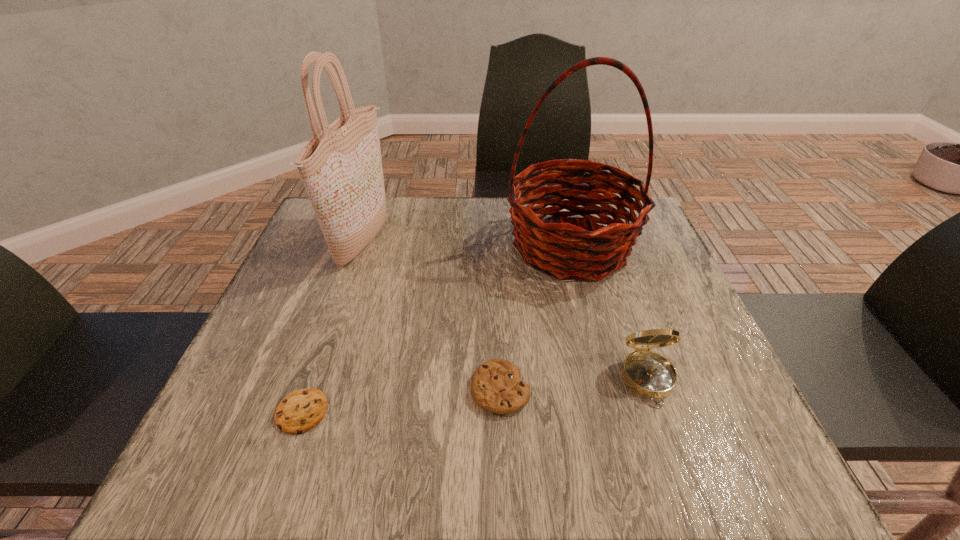
Where is `vacant region located on the back of the taller cookie`? The height and width of the screenshot is (540, 960). vacant region located on the back of the taller cookie is located at coordinates [x=496, y=282].

Identify the location of vacant point located 0.100m on the right of the shorter cookie. (386, 412).

Identify the location of shopping bag that is at the far edge. This screenshot has height=540, width=960. (341, 167).

Find the location of a particular element. This screenshot has width=960, height=540. basket located in the far edge section of the desktop is located at coordinates (565, 250).

At what (x,y) coordinates should I click in order to perform the action: click on object located in the near edge section of the desktop. Please return your answer as a coordinate pair (x, y). Looking at the image, I should click on (300, 411).

At what (x,y) coordinates should I click in order to perform the action: click on shopping bag located in the left edge section of the desktop. Please return your answer as a coordinate pair (x, y). Looking at the image, I should click on (341, 167).

Where is `cookie situated at the left edge`? cookie situated at the left edge is located at coordinates point(300,411).

Locate an element on the screen. basket that is at the right edge is located at coordinates (565, 250).

The width and height of the screenshot is (960, 540). Identify the location of compass that is at the right edge. (648, 374).

Identify the location of object that is at the far left corner. (341, 167).